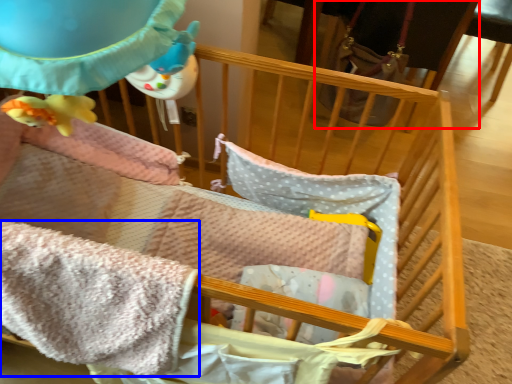
Question: Among these objects, which one is farthest to the camera, feeding chair (highlighted by a red box) or blanket (highlighted by a blue box)?

Choices:
 (A) feeding chair
 (B) blanket

Answer: (A)